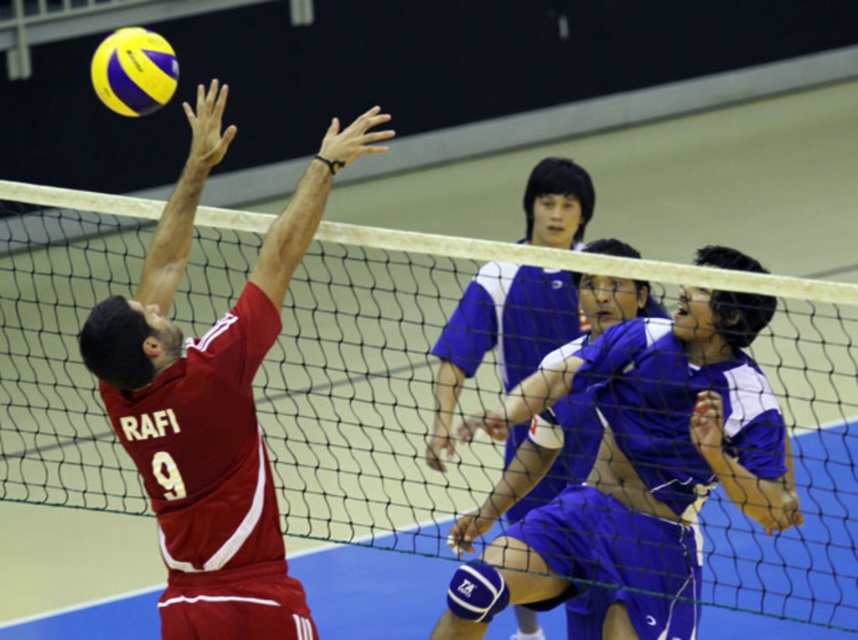
You are a volleyball player standing on the court and see the white mesh net at center and the matte red jersey at upper left. Which object is closer to your left side?

The white mesh net at center is positioned on the left side of matte red jersey at upper left, so the white mesh net at center is closer to your left side.